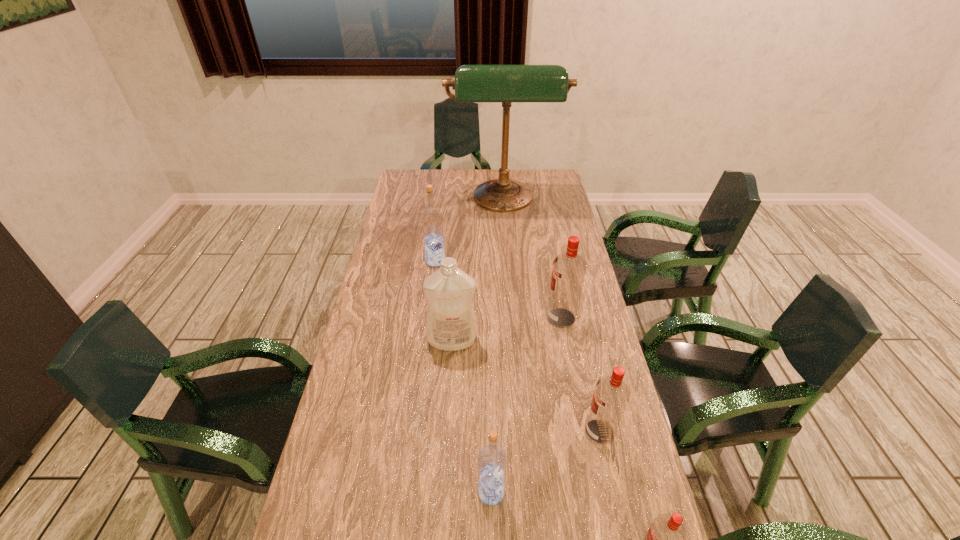
Where is `the second closest blue vodka relative to the farthest red vodka`? the second closest blue vodka relative to the farthest red vodka is located at coordinates (492, 460).

This screenshot has width=960, height=540. I want to click on blue vodka that can be found as the second closest to the white detergent, so click(x=492, y=460).

Where is `free spot that satisfies the following two spatial constraints: 1. on the front side of the right blue vodka; 2. on the right side of the detergent`? free spot that satisfies the following two spatial constraints: 1. on the front side of the right blue vodka; 2. on the right side of the detergent is located at coordinates (443, 492).